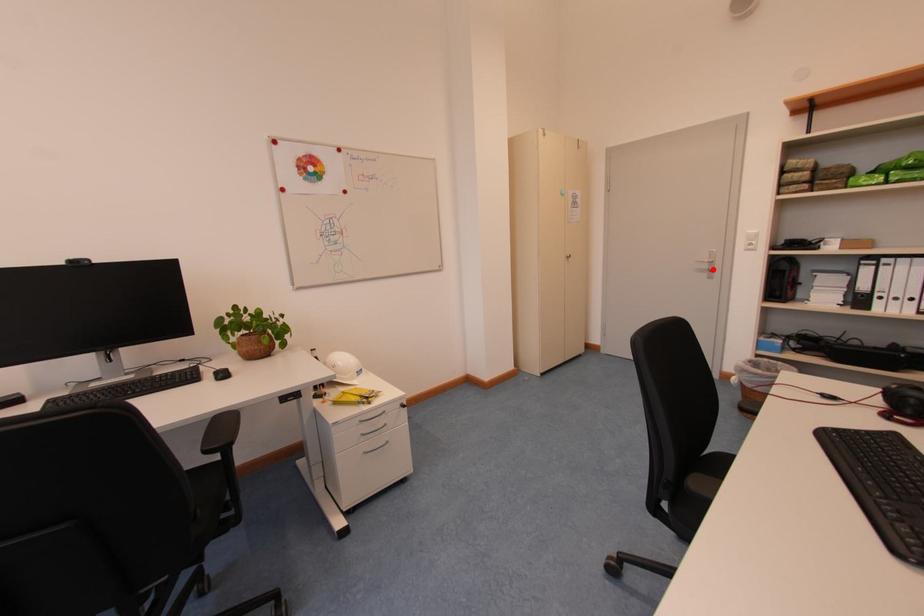
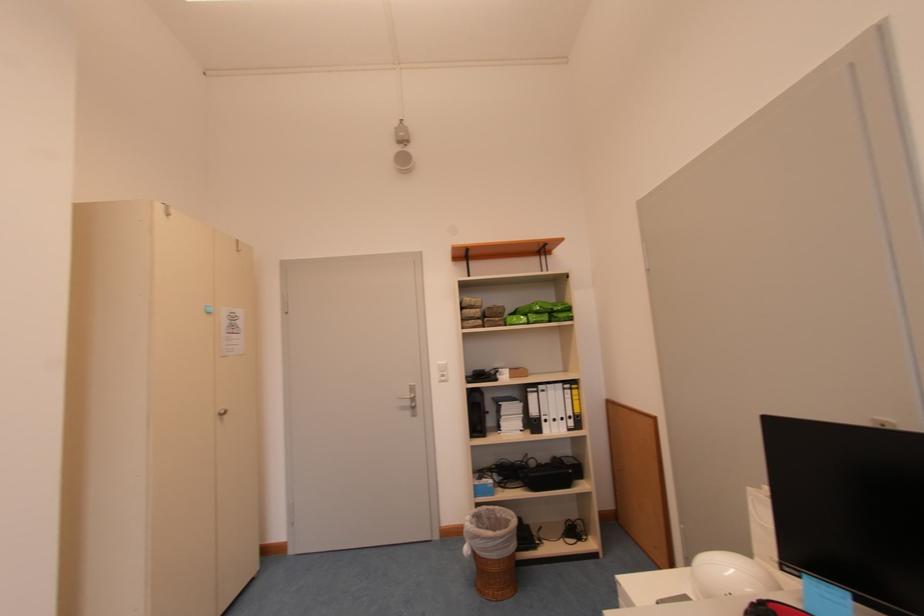
Locate, in the second image, the point that corresponds to the highlighted location in the first image.

(415, 406)